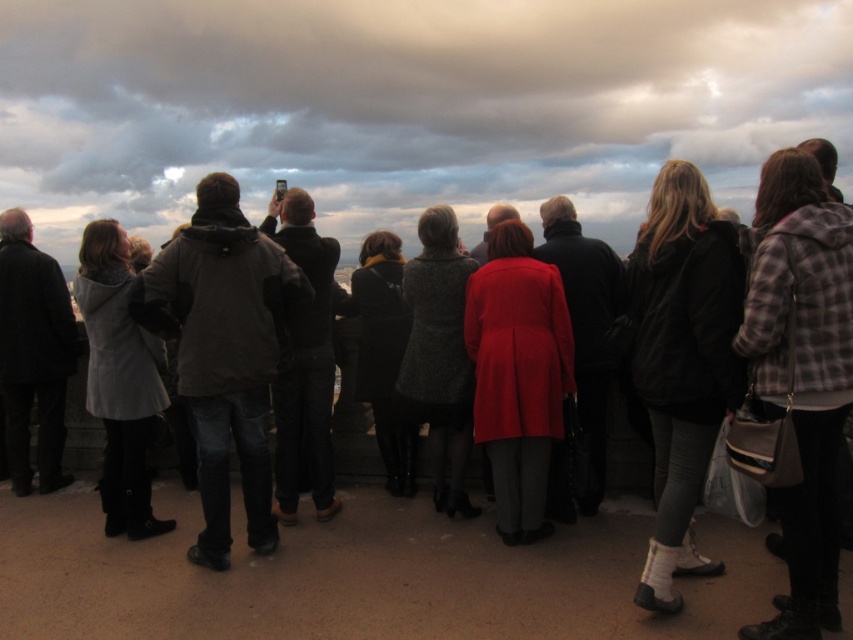
You are a photographer trying to capture a group photo of the plaid wool jacket at right and the dark gray jacket at center. Since you want to ensure both jackets are fully visible in the frame, which jacket should you position closer to the camera to avoid cropping?

The plaid wool jacket at right is narrower than the dark gray jacket at center. To ensure both are fully visible, position the wider dark gray jacket at center closer to the camera so its width can be accommodated without cropping.